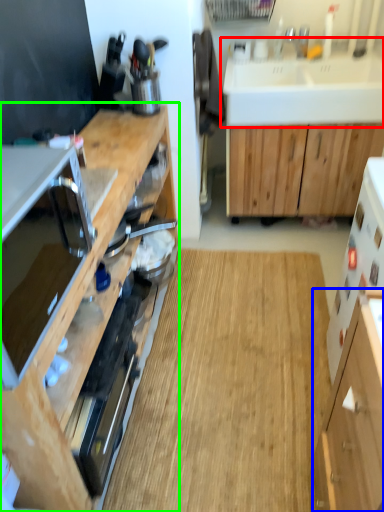
Question: Which object is the farthest from sink (highlighted by a red box)? Choose among these: cabinetry (highlighted by a blue box) or cabinetry (highlighted by a green box).

Choices:
 (A) cabinetry
 (B) cabinetry

Answer: (A)